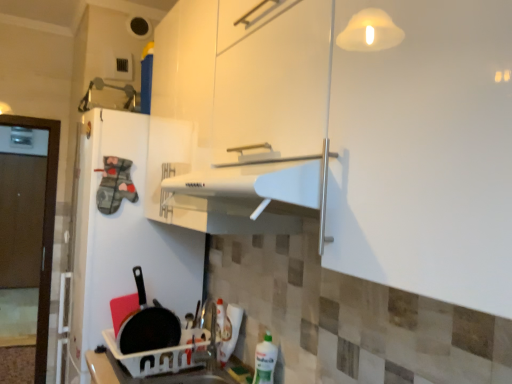
Question: Can you confirm if black matte frying pan at lower left is wider than white matte refrigerator at left?

Choices:
 (A) yes
 (B) no

Answer: (B)

Question: Could you tell me if black matte frying pan at lower left is turned towards white matte refrigerator at left?

Choices:
 (A) no
 (B) yes

Answer: (A)

Question: From the image's perspective, does black matte frying pan at lower left appear higher than white matte refrigerator at left?

Choices:
 (A) no
 (B) yes

Answer: (A)

Question: Can you confirm if black matte frying pan at lower left is shorter than white matte refrigerator at left?

Choices:
 (A) no
 (B) yes

Answer: (B)

Question: Is black matte frying pan at lower left closer to the viewer compared to white matte refrigerator at left?

Choices:
 (A) yes
 (B) no

Answer: (A)

Question: Is white matte refrigerator at left at the back of black matte frying pan at lower left?

Choices:
 (A) yes
 (B) no

Answer: (A)

Question: Is white plastic sink at lower center positioned far away from black matte frying pan at lower left?

Choices:
 (A) no
 (B) yes

Answer: (A)

Question: From a real-world perspective, is white plastic sink at lower center located beneath black matte frying pan at lower left?

Choices:
 (A) yes
 (B) no

Answer: (A)

Question: Does white plastic sink at lower center come in front of black matte frying pan at lower left?

Choices:
 (A) yes
 (B) no

Answer: (A)

Question: Considering the relative sizes of white plastic sink at lower center and black matte frying pan at lower left in the image provided, is white plastic sink at lower center thinner than black matte frying pan at lower left?

Choices:
 (A) no
 (B) yes

Answer: (A)

Question: Is black matte frying pan at lower left at the back of white plastic sink at lower center?

Choices:
 (A) no
 (B) yes

Answer: (A)

Question: Does white plastic sink at lower center turn towards black matte frying pan at lower left?

Choices:
 (A) no
 (B) yes

Answer: (A)

Question: Considering the relative positions of green plastic bottle at lower right and black matte frying pan at lower left in the image provided, is green plastic bottle at lower right in front of black matte frying pan at lower left?

Choices:
 (A) no
 (B) yes

Answer: (B)